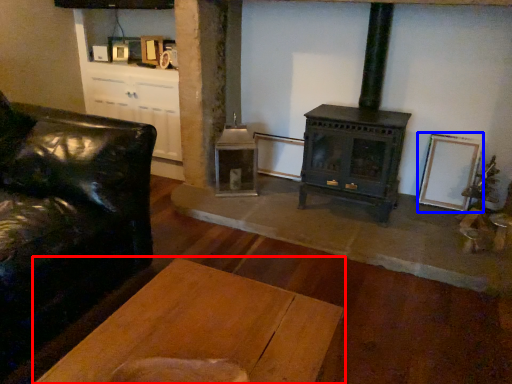
Question: Which object is further to the camera taking this photo, table (highlighted by a red box) or picture frame (highlighted by a blue box)?

Choices:
 (A) table
 (B) picture frame

Answer: (B)